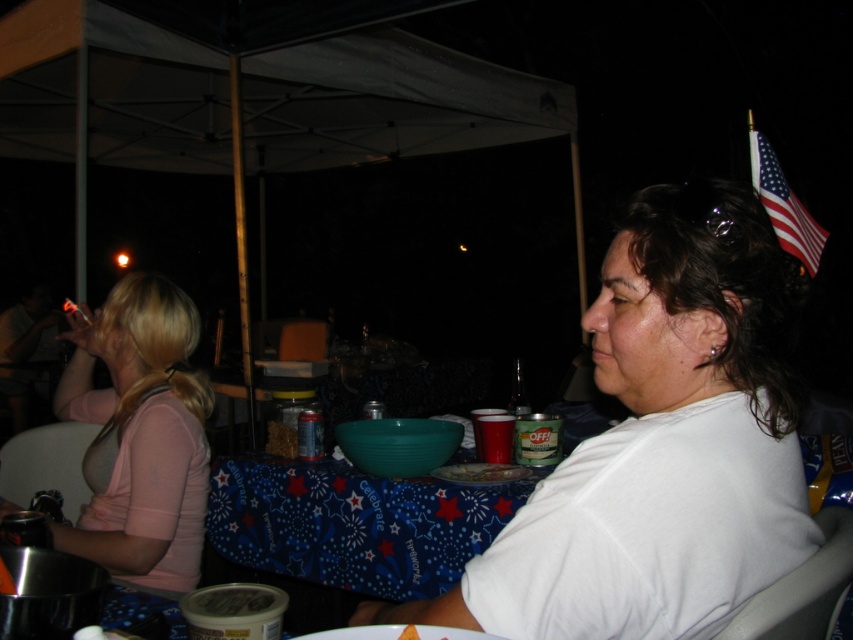
Question: Which object appears closest to the camera in this image?

Choices:
 (A) pink fabric shirt at left
 (B) american flag at upper right
 (C) translucent plastic bowl at center

Answer: (B)

Question: Is white matte shirt at center positioned behind american flag at upper right?

Choices:
 (A) no
 (B) yes

Answer: (A)

Question: Is blue fabric table at center to the left of yellow crispy chip at center from the viewer's perspective?

Choices:
 (A) no
 (B) yes

Answer: (B)

Question: Is white matte shirt at center in front of translucent plastic bowl at center?

Choices:
 (A) no
 (B) yes

Answer: (B)

Question: Which point is farther to the camera?

Choices:
 (A) (67, 333)
 (B) (410, 636)
 (C) (795, 438)
 (D) (778, 170)

Answer: (D)

Question: Based on their relative distances, which object is farther from the white matte shirt at center?

Choices:
 (A) blue fabric table at center
 (B) american flag at upper right

Answer: (B)